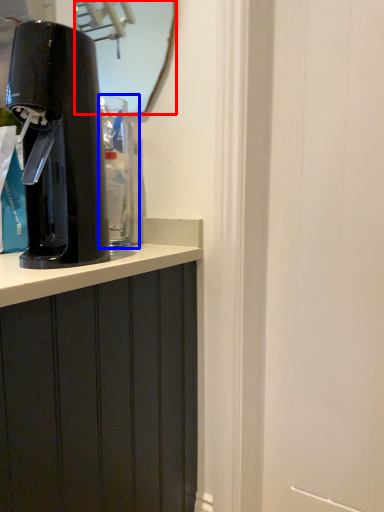
Question: Among these objects, which one is nearest to the camera, mirror (highlighted by a red box) or water cooler (highlighted by a blue box)?

Choices:
 (A) mirror
 (B) water cooler

Answer: (B)